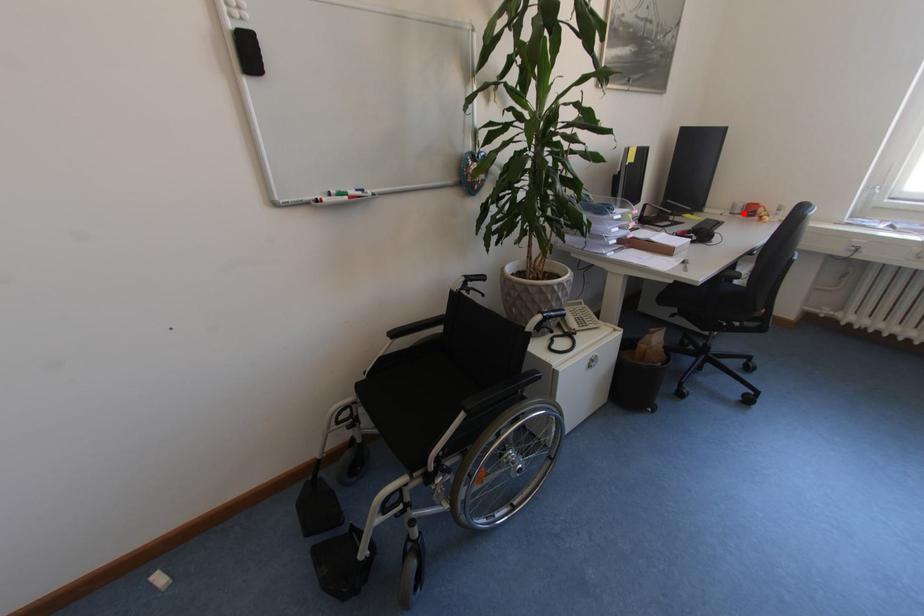
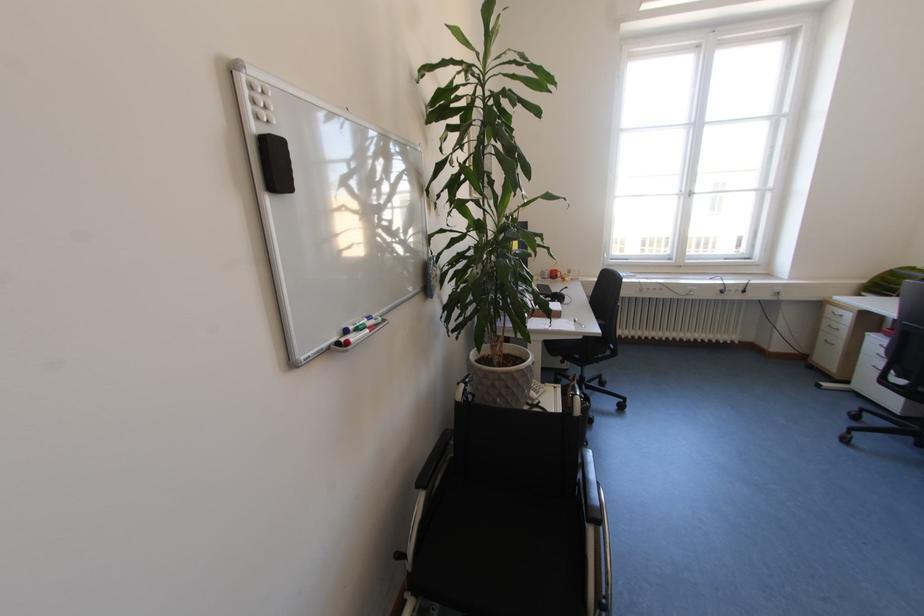
The point at the highlighted location is marked in the first image. Where is the corresponding point in the second image?

(553, 278)